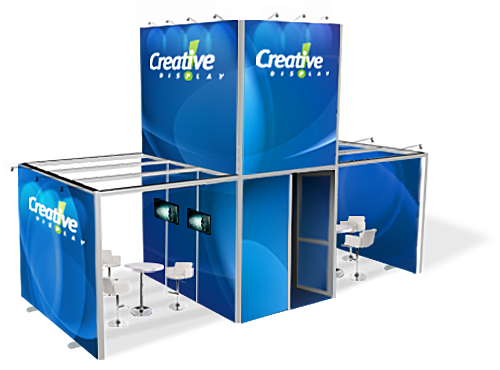
I want to click on chairs, so click(187, 271), click(364, 247).